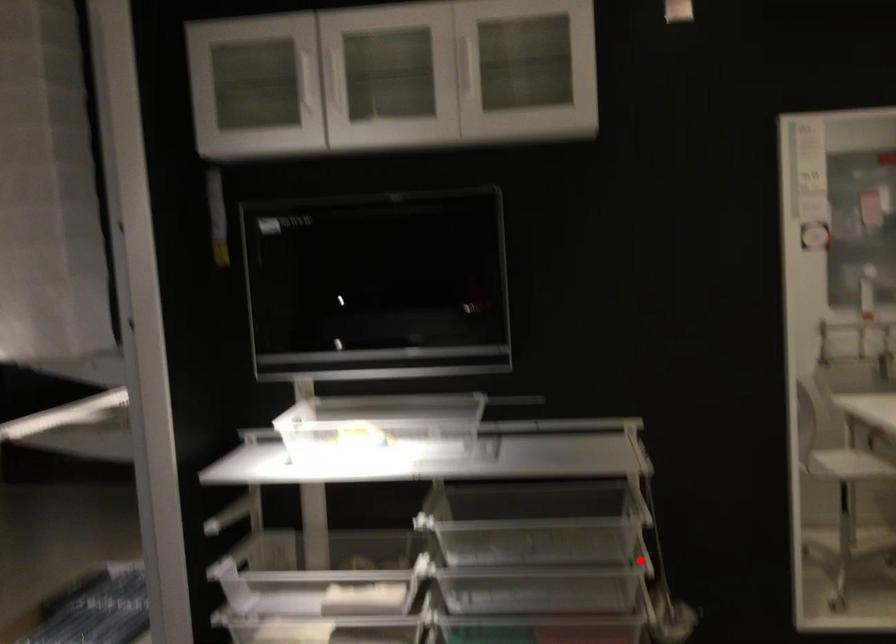
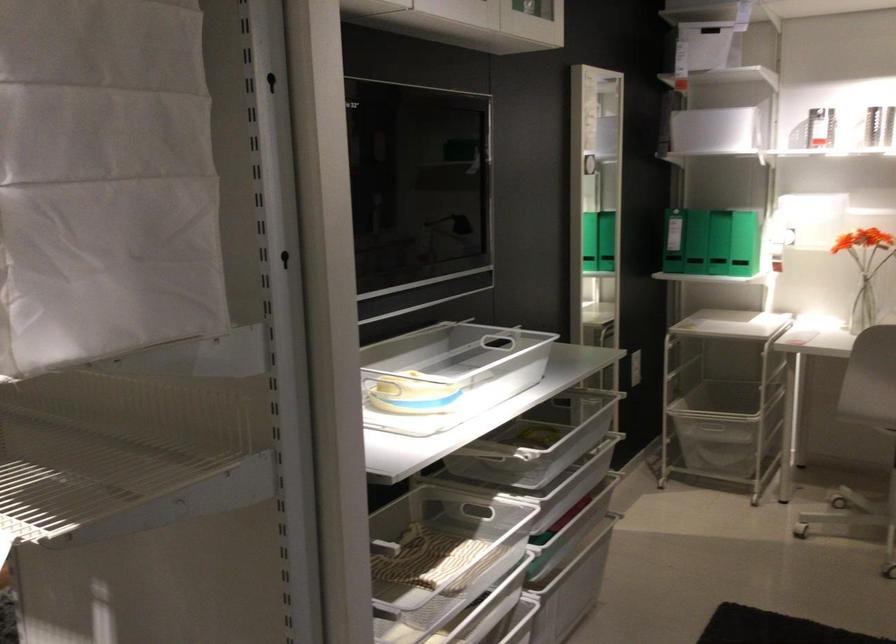
Question: I am providing you with two images of the same scene from different viewpoints. A red point is shown in image1. For the corresponding object point in image2, is it positioned nearer or farther from the camera?

Choices:
 (A) Nearer
 (B) Farther

Answer: (B)